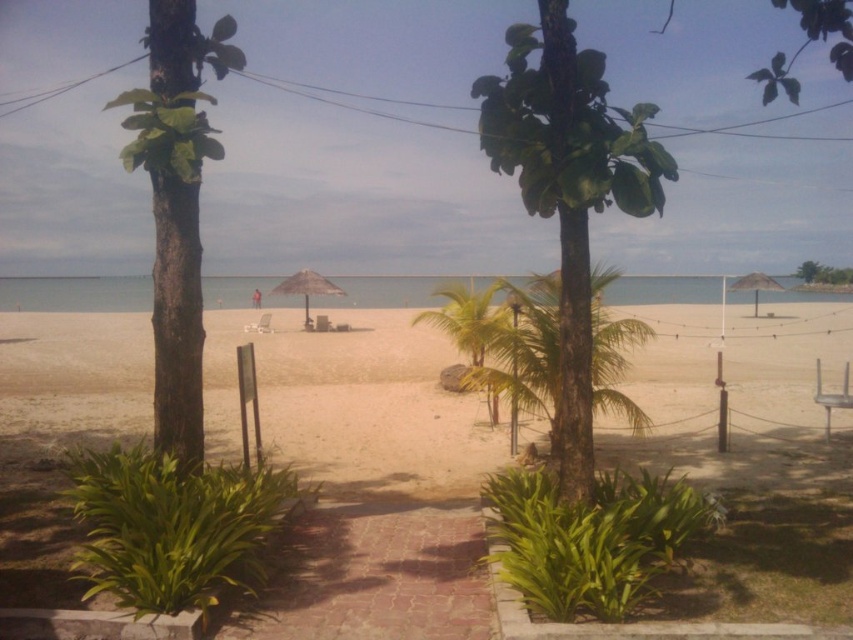
Does green leafy palm tree at center have a greater width compared to beige fabric umbrella at right?

Incorrect, green leafy palm tree at center's width does not surpass beige fabric umbrella at right's.

Is point (610, 396) closer to viewer compared to point (778, 284)?

Yes, point (610, 396) is in front of point (778, 284).

Who is more distant from viewer, (479,380) or (746,280)?

The point (746,280) is behind.

Identify the location of green leafy palm tree at center. The image size is (853, 640). (527, 353).

Is green rough bark tree at left above green leafy tree at upper right?

Indeed, green rough bark tree at left is positioned over green leafy tree at upper right.

Does green rough bark tree at left have a larger size compared to green leafy tree at upper right?

Correct, green rough bark tree at left is larger in size than green leafy tree at upper right.

Is point (170, 275) positioned in front of point (833, 273)?

Yes, it is in front of point (833, 273).

The width and height of the screenshot is (853, 640). What are the coordinates of `green rough bark tree at left` in the screenshot? It's located at (177, 205).

Can you confirm if light beige sand at center is smaller than green leafy tree at upper right?

Incorrect, light beige sand at center is not smaller in size than green leafy tree at upper right.

Which is in front, point (780, 458) or point (833, 266)?

Point (780, 458)

I want to click on light beige sand at center, so click(x=354, y=403).